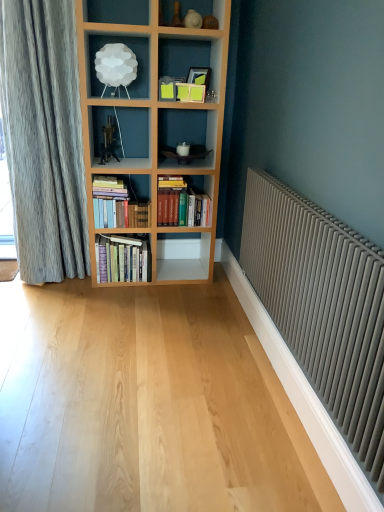
You are a GUI agent. You are given a task and a screenshot of the screen. Output one action in this format:
    pyautogui.click(x=<x>, y=<y>)
    Task: Click on the vacant region below hardcover books at center, positioned as the third book in left-to-right order (from a real-world perspective)
    The width and height of the screenshot is (384, 512).
    Given the screenshot: What is the action you would take?
    pyautogui.click(x=178, y=276)